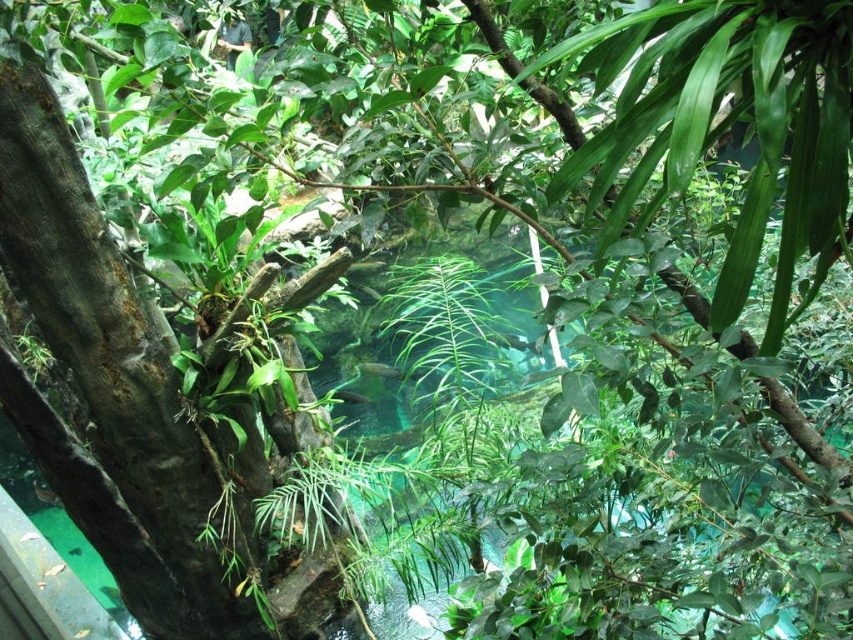
Which is more to the left, green glossy fish at center or translucent green fish at center?

translucent green fish at center is more to the left.

Which of these two, green glossy fish at center or translucent green fish at center, stands taller?

green glossy fish at center is taller.

Describe the element at coordinates (386, 371) in the screenshot. I see `green glossy fish at center` at that location.

Image resolution: width=853 pixels, height=640 pixels. I want to click on green glossy fish at center, so 386,371.

Does green glossy fish at center have a smaller size compared to green translucent fish at center?

Actually, green glossy fish at center might be larger than green translucent fish at center.

Image resolution: width=853 pixels, height=640 pixels. Describe the element at coordinates (386, 371) in the screenshot. I see `green glossy fish at center` at that location.

This screenshot has width=853, height=640. I want to click on green glossy fish at center, so click(x=386, y=371).

Who is positioned more to the left, green translucent fish at center or translucent green fish at center?

translucent green fish at center

Which is above, green translucent fish at center or translucent green fish at center?

Positioned higher is green translucent fish at center.

Is point (337, 396) behind point (120, 598)?

That is True.

Find the location of a particular element. The width and height of the screenshot is (853, 640). green translucent fish at center is located at coordinates (347, 396).